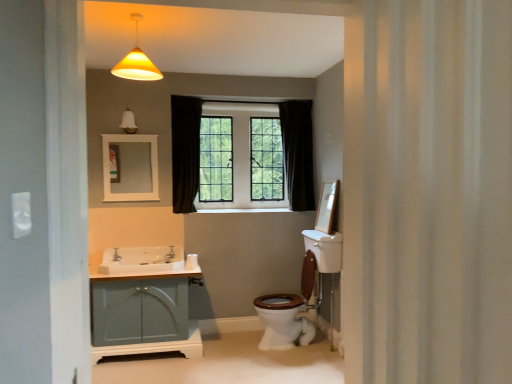
Question: Is white matte mirror at upper center taller than white glossy sink at lower left?

Choices:
 (A) yes
 (B) no

Answer: (A)

Question: Is the depth of white matte mirror at upper center greater than that of white glossy sink at lower left?

Choices:
 (A) yes
 (B) no

Answer: (A)

Question: Does white matte mirror at upper center have a lesser width compared to white glossy sink at lower left?

Choices:
 (A) yes
 (B) no

Answer: (A)

Question: From a real-world perspective, is white matte mirror at upper center located beneath white glossy sink at lower left?

Choices:
 (A) no
 (B) yes

Answer: (A)

Question: Is white matte mirror at upper center looking in the opposite direction of white glossy sink at lower left?

Choices:
 (A) yes
 (B) no

Answer: (B)

Question: Does white matte mirror at upper center have a greater width compared to white glossy sink at lower left?

Choices:
 (A) yes
 (B) no

Answer: (B)

Question: Is matte silver faucet at sink left, the 1th faucet in the front-to-back sequence, at the right side of white matte toilet paper at lower center?

Choices:
 (A) no
 (B) yes

Answer: (A)

Question: Does matte silver faucet at sink left, the 1th faucet in the front-to-back sequence, have a larger size compared to white matte toilet paper at lower center?

Choices:
 (A) yes
 (B) no

Answer: (B)

Question: Considering the relative sizes of matte silver faucet at sink left, the second faucet in the right-to-left sequence, and white matte toilet paper at lower center in the image provided, is matte silver faucet at sink left, the second faucet in the right-to-left sequence, smaller than white matte toilet paper at lower center?

Choices:
 (A) yes
 (B) no

Answer: (A)

Question: From a real-world perspective, is matte silver faucet at sink left, placed as the second faucet when sorted from back to front, over white matte toilet paper at lower center?

Choices:
 (A) no
 (B) yes

Answer: (B)

Question: From a real-world perspective, is matte silver faucet at sink left, the 1th faucet in the front-to-back sequence, physically below white matte toilet paper at lower center?

Choices:
 (A) yes
 (B) no

Answer: (B)

Question: Is matte silver faucet at sink left, the 1th faucet in the front-to-back sequence, outside of white matte toilet paper at lower center?

Choices:
 (A) no
 (B) yes

Answer: (B)

Question: Is white glossy sink at lower left at the left side of white textured shower curtain at right?

Choices:
 (A) yes
 (B) no

Answer: (A)